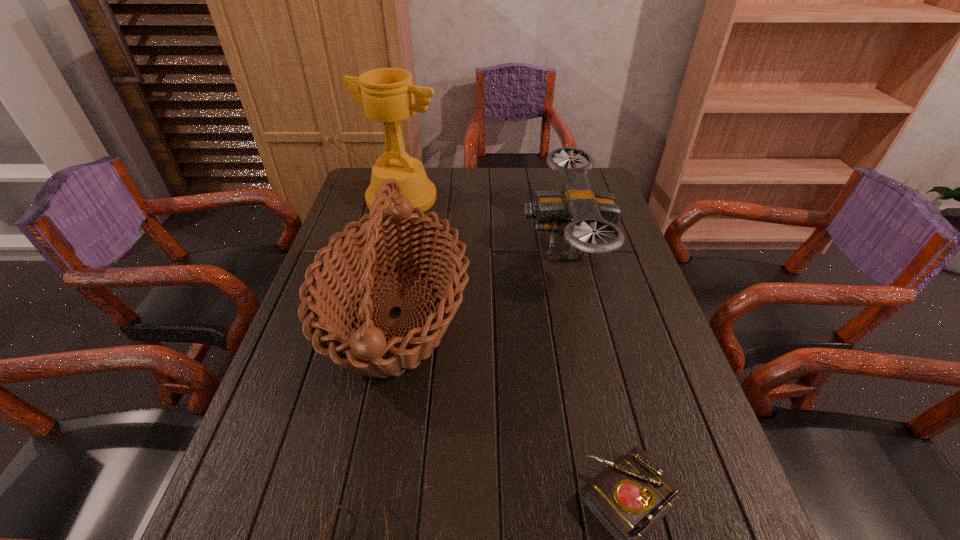
Find the location of a particular element. This screenshot has width=960, height=540. blank region between the fourth shortest object and the third tallest object is located at coordinates (480, 280).

The height and width of the screenshot is (540, 960). Identify the location of empty space between the tallest object and the drone. (484, 221).

The height and width of the screenshot is (540, 960). I want to click on unoccupied area between the tallest object and the third tallest object, so click(x=484, y=221).

The image size is (960, 540). What are the coordinates of `object that is the second closest to the award` in the screenshot? It's located at (582, 215).

This screenshot has width=960, height=540. In order to click on the second closest object to the award in this screenshot , I will do `click(582, 215)`.

I want to click on vacant position in the image that satisfies the following two spatial constraints: 1. on the front-facing side of the drone; 2. on the front side of the basket, so click(x=582, y=315).